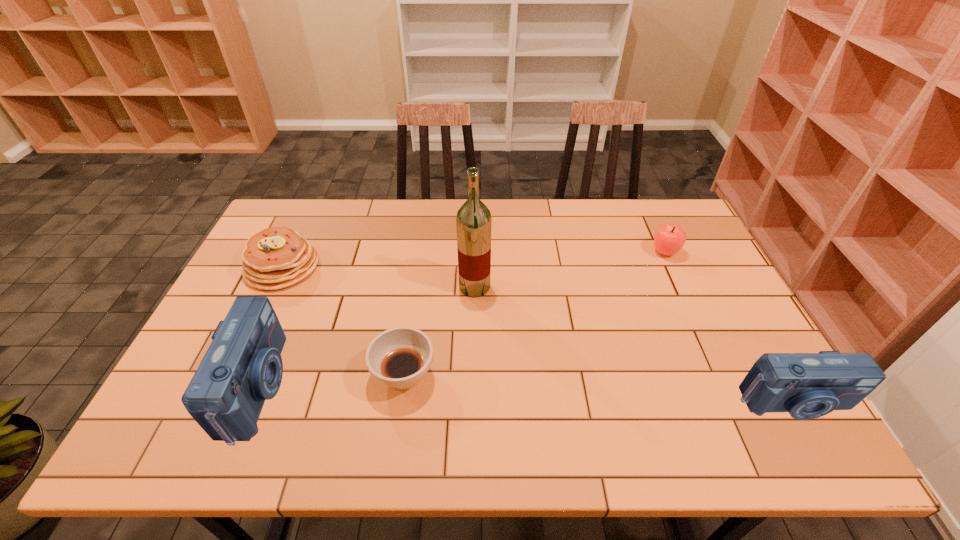
This screenshot has width=960, height=540. I want to click on blank area located on the lens of the fifth shortest object, so [x=344, y=388].

Where is `vacant space located on the left of the apple`? This screenshot has height=540, width=960. vacant space located on the left of the apple is located at coordinates (554, 252).

I want to click on vacant space situated on the right of the liquor, so click(608, 287).

At what (x,y) coordinates should I click in order to perform the action: click on vacant space located 0.110m on the front of the pancake. Please return your answer as a coordinate pair (x, y). Image resolution: width=960 pixels, height=540 pixels. Looking at the image, I should click on (256, 321).

At what (x,y) coordinates should I click in order to perform the action: click on free location located 0.390m on the right of the soup bowl. Please return your answer as a coordinate pair (x, y). The image size is (960, 540). Looking at the image, I should click on (593, 375).

You are a GUI agent. You are given a task and a screenshot of the screen. Output one action in this format:
    pyautogui.click(x=<x>, y=<y>)
    Task: Click on the soup bowl that is at the near edge
    This screenshot has width=960, height=540.
    Given the screenshot: What is the action you would take?
    pyautogui.click(x=399, y=357)

You are a GUI agent. You are given a task and a screenshot of the screen. Output one action in this format:
    pyautogui.click(x=<x>, y=<y>)
    Task: Click on the camera present at the left edge
    The width and height of the screenshot is (960, 540).
    Given the screenshot: What is the action you would take?
    pyautogui.click(x=243, y=367)

The height and width of the screenshot is (540, 960). In order to click on pancake situated at the left edge in this screenshot , I will do `click(277, 257)`.

Locate an element on the screen. The width and height of the screenshot is (960, 540). camera that is positioned at the right edge is located at coordinates (807, 385).

This screenshot has height=540, width=960. I want to click on apple situated at the right edge, so click(x=668, y=239).